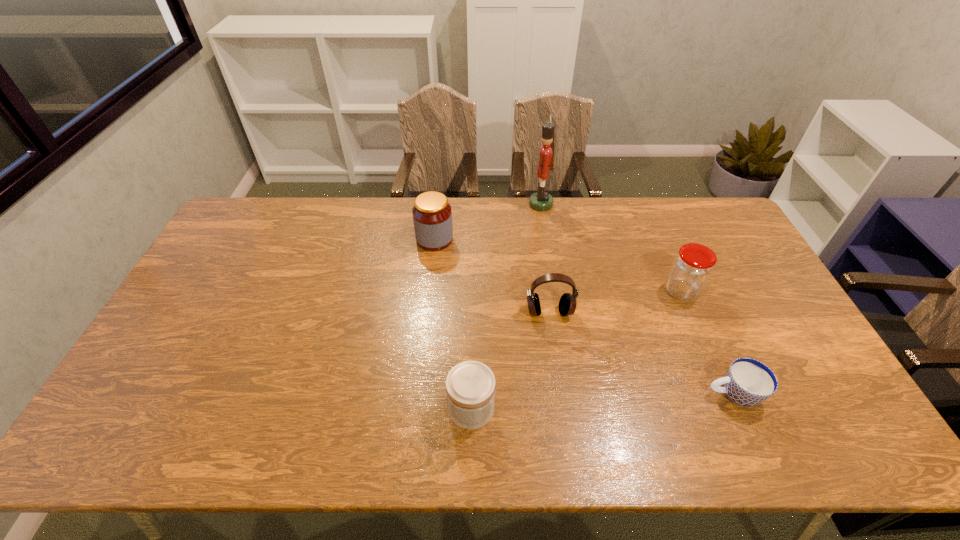
Locate an element on the screen. free spot between the shortest object and the rightmost jar is located at coordinates (707, 343).

Find the location of a particular element. free spot between the farthest object and the headset is located at coordinates (545, 258).

Identify the location of vacant space that's between the rightmost jar and the leftmost jar. This screenshot has width=960, height=540. (558, 265).

Where is `vacant region between the second farthest jar and the shortest object`? The image size is (960, 540). vacant region between the second farthest jar and the shortest object is located at coordinates (707, 343).

At what (x,y) coordinates should I click in order to perform the action: click on vacant point located between the rightmost jar and the second jar from left to right. Please return your answer as a coordinate pair (x, y). Looking at the image, I should click on (576, 349).

Find the location of `vacant area between the second jar from right to left and the nutcracker`. vacant area between the second jar from right to left and the nutcracker is located at coordinates (506, 306).

The height and width of the screenshot is (540, 960). Find the location of `free space between the shortest object and the headset`. free space between the shortest object and the headset is located at coordinates (641, 353).

This screenshot has height=540, width=960. Find the location of `free space that is in between the farthest object and the second nearest jar`. free space that is in between the farthest object and the second nearest jar is located at coordinates (611, 248).

Identify which object is located as the third nearest to the leftmost object. Please provide its 2D coordinates. Your answer should be formatted as a tuple, i.e. [(x, y)], where the tuple contains the x and y coordinates of a point satisfying the conditions above.

[(470, 385)]

Locate which object is the third closest to the leftmost jar. Please provide its 2D coordinates. Your answer should be formatted as a tuple, i.e. [(x, y)], where the tuple contains the x and y coordinates of a point satisfying the conditions above.

[(470, 385)]